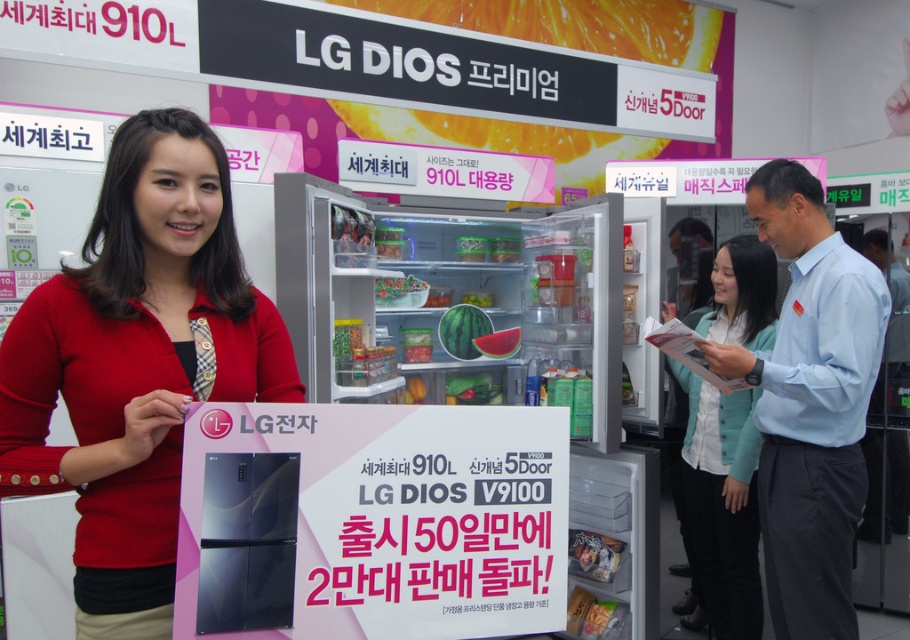
Consider the image. You are a customer in the electronics store and want to find the matte black refrigerator at left. According to the store layout, where should you look relative to the promotional sign held by the woman?

The matte black refrigerator at left is located at point (137, 364), so you should look to the left side of the promotional sign held by the woman.

You are a customer in an electronics store looking at the LG DIOS refrigerators. You see the matte black refrigerator at left and the translucent plastic container at center. Which one is larger in size?

The matte black refrigerator at left is bigger than the translucent plastic container at center.